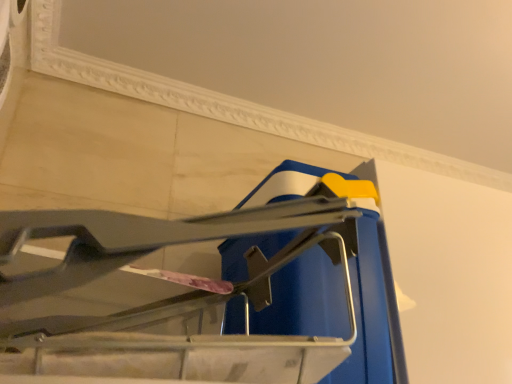
Question: Is white textured wall at upper center inside the boundaries of blue plastic bucket at center, or outside?

Choices:
 (A) inside
 (B) outside

Answer: (B)

Question: In terms of size, does white textured wall at upper center appear bigger or smaller than blue plastic bucket at center?

Choices:
 (A) small
 (B) big

Answer: (A)

Question: In the image, is white textured wall at upper center on the left side or the right side of blue plastic bucket at center?

Choices:
 (A) left
 (B) right

Answer: (B)

Question: From the image's perspective, relative to white textured wall at upper center, is blue plastic bucket at center above or below?

Choices:
 (A) below
 (B) above

Answer: (A)

Question: Is blue plastic bucket at center wider or thinner than white textured wall at upper center?

Choices:
 (A) thin
 (B) wide

Answer: (A)

Question: Would you say blue plastic bucket at center is to the left or to the right of white textured wall at upper center in the picture?

Choices:
 (A) right
 (B) left

Answer: (B)

Question: From a real-world perspective, is blue plastic bucket at center physically located above or below white textured wall at upper center?

Choices:
 (A) above
 (B) below

Answer: (B)